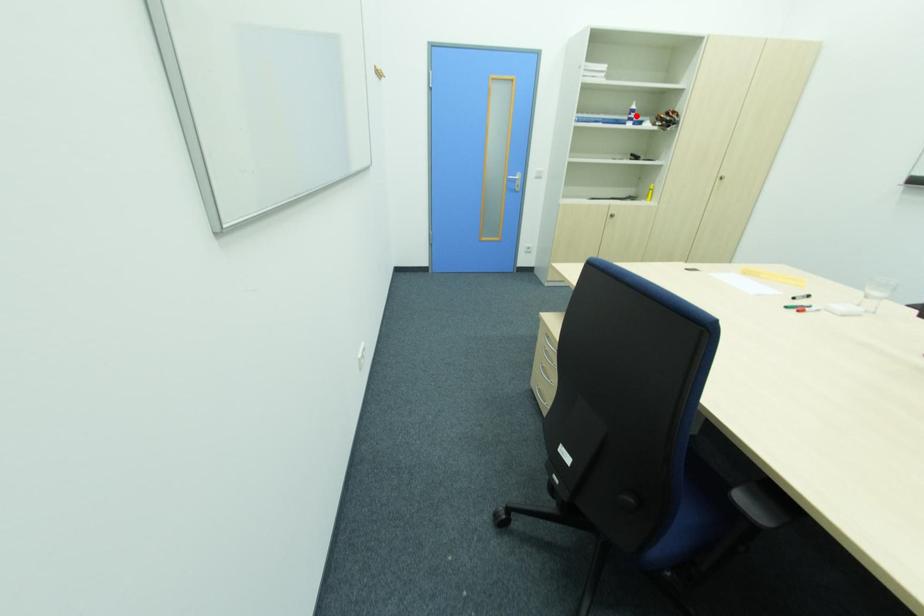
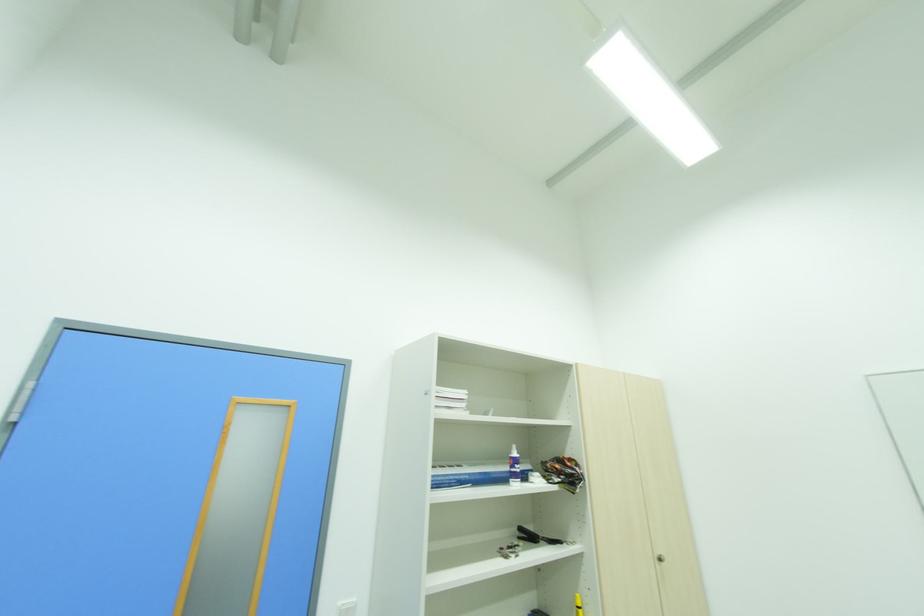
In the second image, find the point that corresponds to the highlighted location in the first image.

(520, 469)